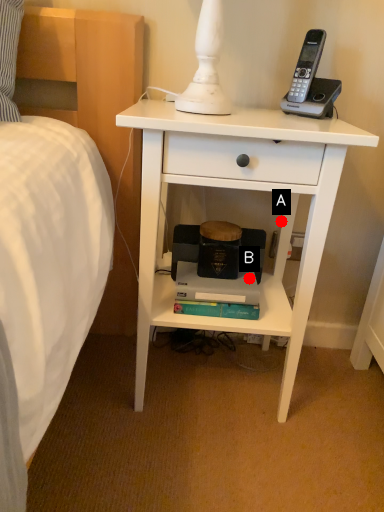
Question: Two points are circled on the image, labeled by A and B beside each circle. Which point is farther from the camera taking this photo?

Choices:
 (A) A is further
 (B) B is further

Answer: (A)